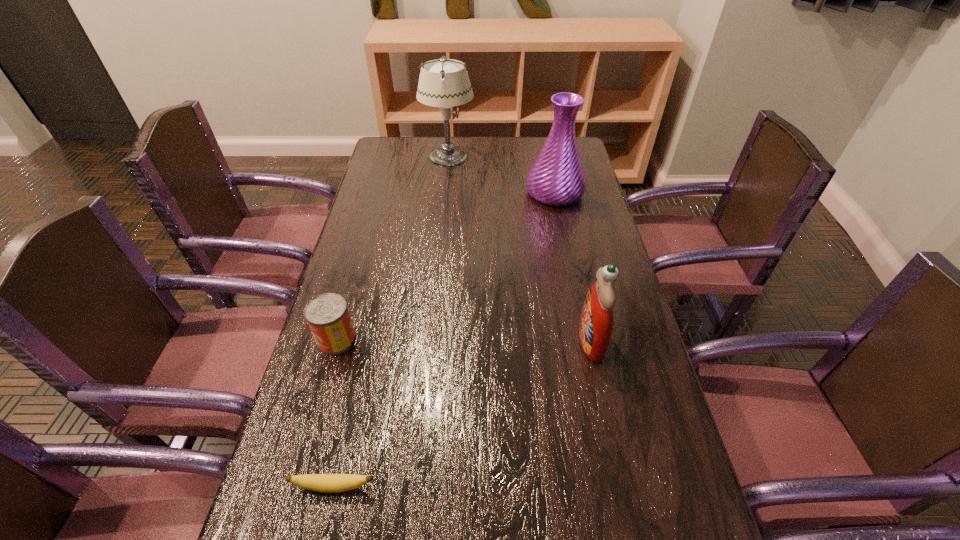
At what (x,y) coordinates should I click in order to perform the action: click on free spot at the right edge of the desktop. Please return your answer as a coordinate pair (x, y). The height and width of the screenshot is (540, 960). Looking at the image, I should click on (671, 504).

Locate an element on the screen. The width and height of the screenshot is (960, 540). unoccupied area between the detergent and the banana is located at coordinates (463, 414).

Locate an element on the screen. This screenshot has height=540, width=960. free space between the second nearest object and the second farthest object is located at coordinates (444, 340).

The image size is (960, 540). I want to click on vacant space in between the lampshade and the detergent, so 519,248.

Identify the location of empty space that is in between the banana and the second farthest object. (444, 340).

At what (x,y) coordinates should I click in order to perform the action: click on vacant space that is in between the second nearest object and the lampshade. Please return your answer as a coordinate pair (x, y). The width and height of the screenshot is (960, 540). Looking at the image, I should click on (391, 321).

Where is `free space between the third tallest object and the vase`? The width and height of the screenshot is (960, 540). free space between the third tallest object and the vase is located at coordinates (573, 267).

In order to click on free space that is in between the farthest object and the third shortest object in this screenshot , I will do `click(393, 248)`.

Locate which object is the fourth closest to the second shortest object. Please provide its 2D coordinates. Your answer should be formatted as a tuple, i.e. [(x, y)], where the tuple contains the x and y coordinates of a point satisfying the conditions above.

[(557, 178)]

I want to click on object that is the second nearest to the second nearest object, so click(x=590, y=539).